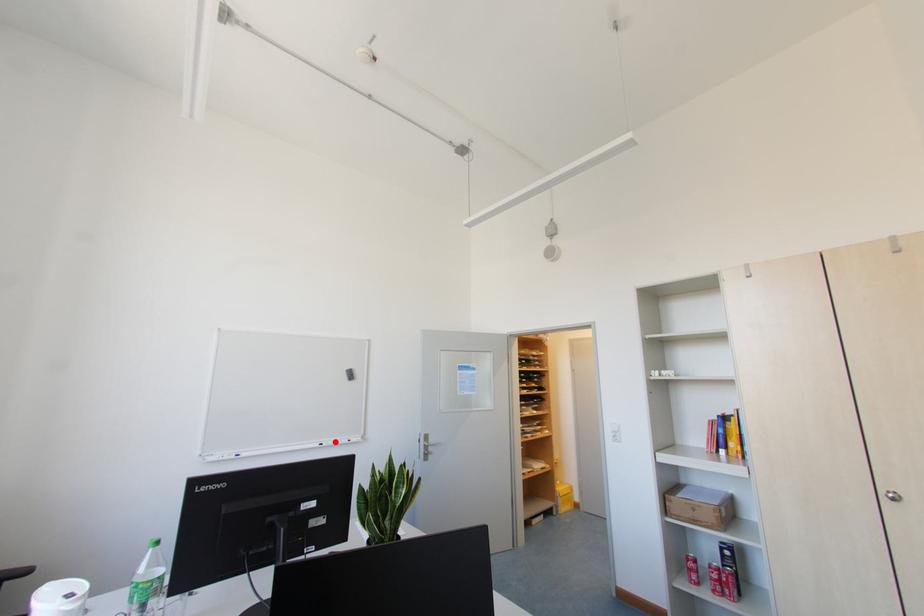
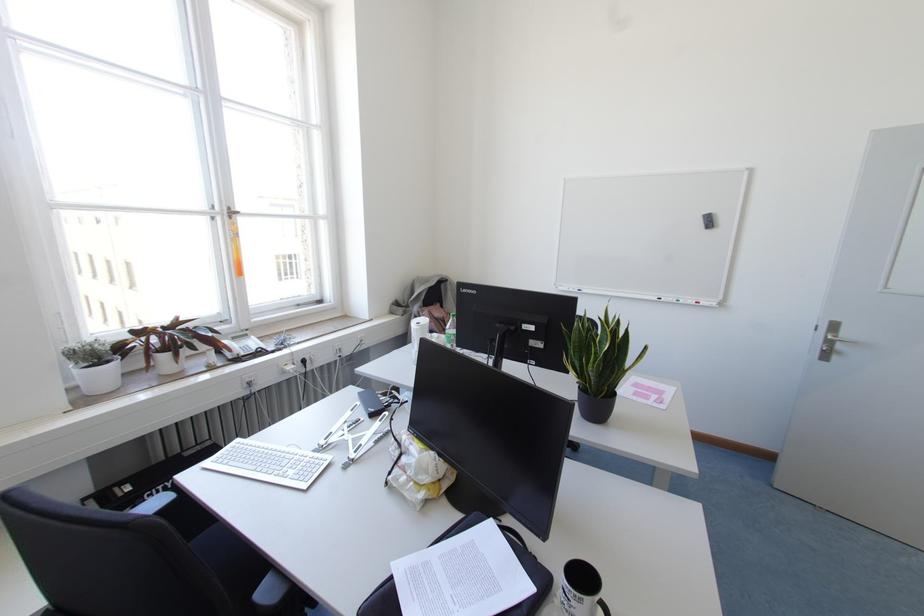
In the second image, find the point that corresponds to the highlighted location in the first image.

(676, 300)